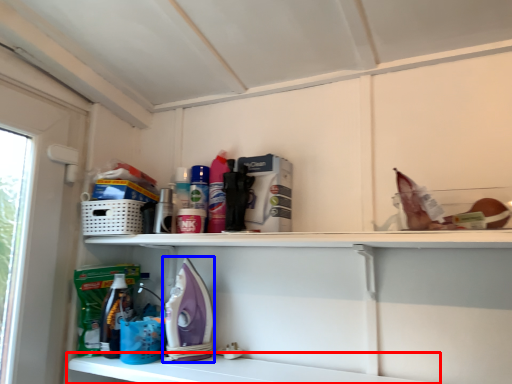
Question: Among these objects, which one is nearest to the camera, shelf (highlighted by a red box) or appliance (highlighted by a blue box)?

Choices:
 (A) shelf
 (B) appliance

Answer: (A)